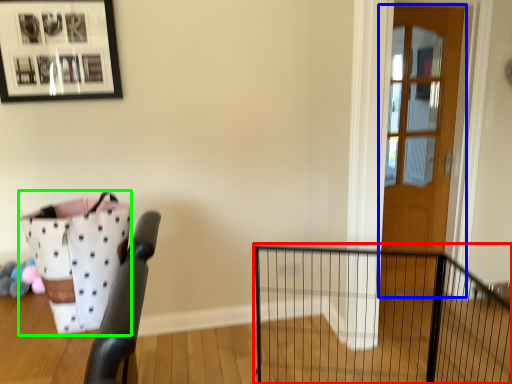
Question: Which object is positioned closest to fence (highlighted by a red box)? Select from door (highlighted by a blue box) and basket (highlighted by a green box).

Choices:
 (A) door
 (B) basket

Answer: (A)